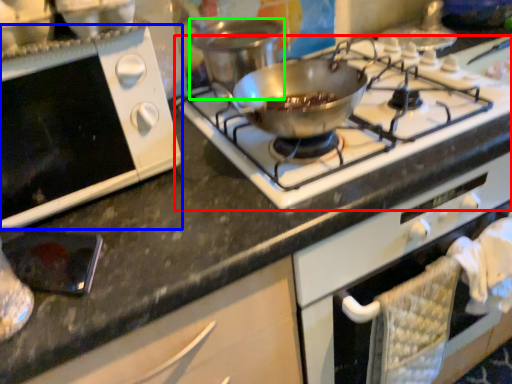
Question: Based on their relative distances, which object is nearer to gas stove (highlighted by a red box)? Choose from oven (highlighted by a blue box) and pot/pan (highlighted by a green box).

Choices:
 (A) oven
 (B) pot/pan

Answer: (B)